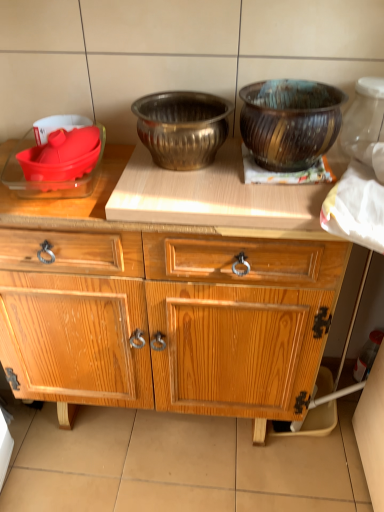
Where is `free point to the right of matte red bowl at upper left, which is counted as the fourth bowl, starting from the right`? The height and width of the screenshot is (512, 384). free point to the right of matte red bowl at upper left, which is counted as the fourth bowl, starting from the right is located at coordinates (114, 155).